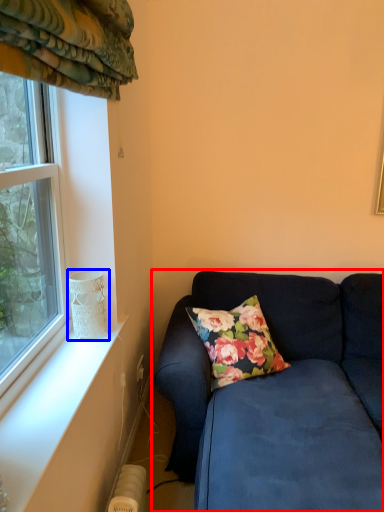
Question: Which of the following is the farthest to the observer, studio couch (highlighted by a red box) or glass vase (highlighted by a blue box)?

Choices:
 (A) studio couch
 (B) glass vase

Answer: (B)